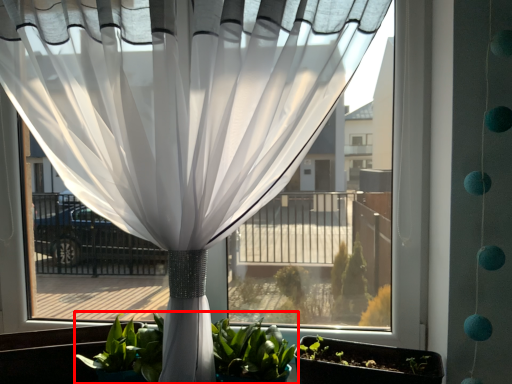
Question: From the image's perspective, what is the correct spatial positioning of houseplant (annotated by the red box) in reference to flowerpot?

Choices:
 (A) below
 (B) above

Answer: (B)